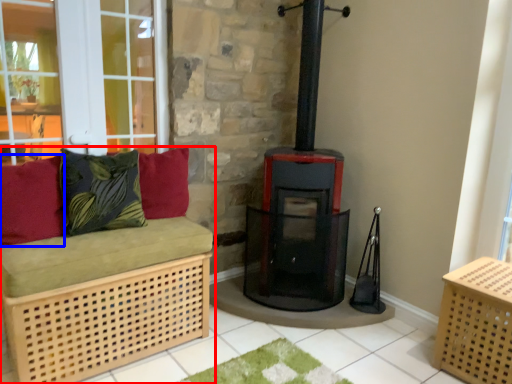
Question: Among these objects, which one is nearest to the camera, furniture (highlighted by a red box) or pillow (highlighted by a blue box)?

Choices:
 (A) furniture
 (B) pillow

Answer: (A)